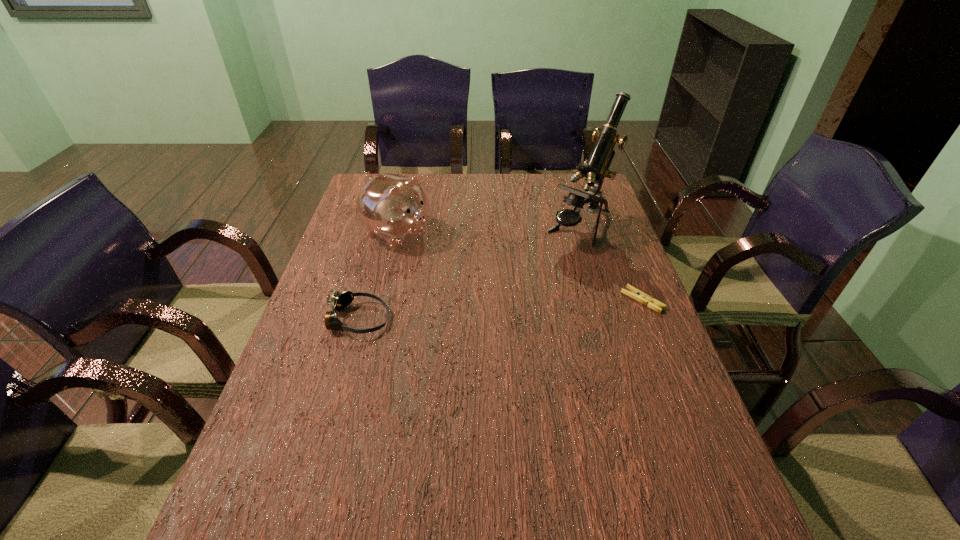
Find the location of a particular element. Image resolution: width=960 pixels, height=540 pixels. unoccupied position between the microscope and the piggy bank is located at coordinates (489, 231).

The height and width of the screenshot is (540, 960). In order to click on the second closest object to the shortest object in this screenshot , I will do `click(394, 207)`.

Identify which object is located as the third nearest to the third shortest object. Please provide its 2D coordinates. Your answer should be formatted as a tuple, i.e. [(x, y)], where the tuple contains the x and y coordinates of a point satisfying the conditions above.

[(636, 294)]

The width and height of the screenshot is (960, 540). I want to click on free space that satisfies the following two spatial constraints: 1. on the front side of the tallest object; 2. on the right side of the clothespin, so click(602, 300).

Where is `vacant area that satisfies the following two spatial constraints: 1. on the back side of the microscope; 2. on the right side of the second tallest object`? vacant area that satisfies the following two spatial constraints: 1. on the back side of the microscope; 2. on the right side of the second tallest object is located at coordinates (398, 229).